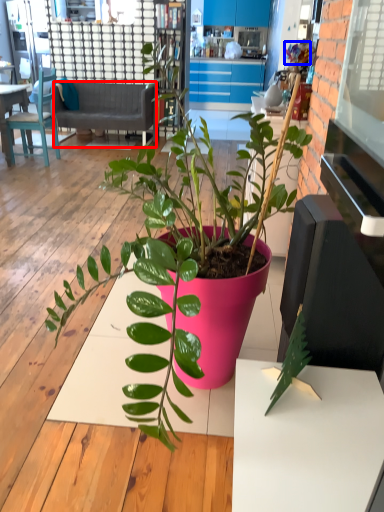
Question: Which of the following is the farthest to the observer, studio couch (highlighted by a red box) or flower (highlighted by a blue box)?

Choices:
 (A) studio couch
 (B) flower

Answer: (B)